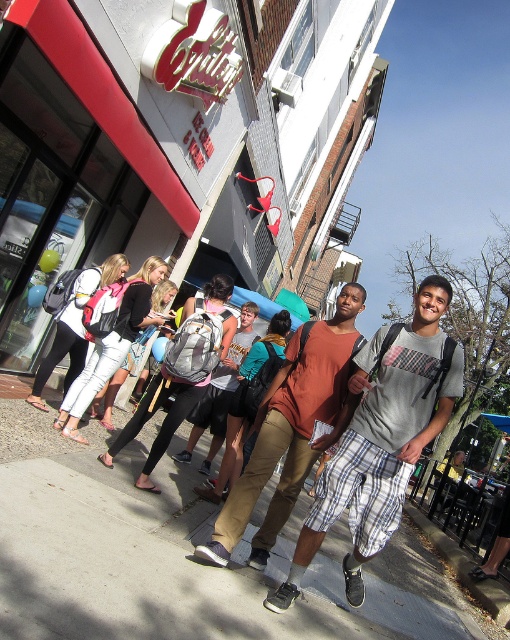
What do you see at coordinates (183, 556) in the screenshot? I see `gray concrete sidewalk at center` at bounding box center [183, 556].

Does gray concrete sidewalk at center have a lesser height compared to brown cotton shirt at center?

Incorrect, gray concrete sidewalk at center's height does not fall short of brown cotton shirt at center's.

Is point (394, 570) closer to camera compared to point (321, 376)?

No, (394, 570) is further to viewer.

The width and height of the screenshot is (510, 640). I want to click on gray concrete sidewalk at center, so click(x=183, y=556).

Consider the image. Which is above, gray cotton t-shirt at center or brown cotton shirt at center?

Positioned higher is brown cotton shirt at center.

Image resolution: width=510 pixels, height=640 pixels. What do you see at coordinates (381, 438) in the screenshot?
I see `gray cotton t-shirt at center` at bounding box center [381, 438].

Measure the distance between point (x=457, y=381) and camera.

Point (x=457, y=381) and camera are 2.90 meters apart.

I want to click on gray cotton t-shirt at center, so click(381, 438).

Is gray concrete sidewalk at center further to the viewer compared to gray cotton t-shirt at center?

No.

Identify the location of gray concrete sidewalk at center. (183, 556).

You are a GUI agent. You are given a task and a screenshot of the screen. Output one action in this format:
    pyautogui.click(x=<x>, y=<y>)
    Task: Click on the gray concrete sidewalk at center
    This screenshot has width=510, height=640.
    Given the screenshot: What is the action you would take?
    pyautogui.click(x=183, y=556)